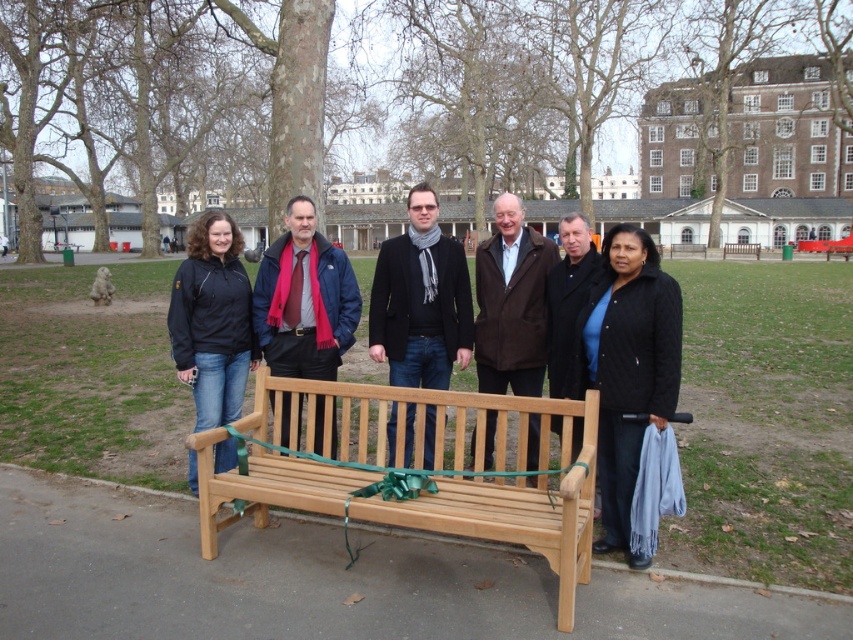
Question: Is natural wood bench at center to the right of black matte jacket at left from the viewer's perspective?

Choices:
 (A) no
 (B) yes

Answer: (B)

Question: Does black quilted jacket at center have a larger size compared to black matte jacket at left?

Choices:
 (A) no
 (B) yes

Answer: (A)

Question: Does brown leather jacket at center have a lesser width compared to wooden bench at center?

Choices:
 (A) yes
 (B) no

Answer: (A)

Question: Which of the following is the closest to the observer?

Choices:
 (A) black quilted jacket at center
 (B) natural wood bench at center
 (C) brown leather jacket at center

Answer: (B)

Question: Considering the real-world distances, which object is closest to the matte blue jacket at center?

Choices:
 (A) black matte jacket at left
 (B) dark gray wool scarf at center
 (C) black quilted jacket at center
 (D) brown leather jacket at center

Answer: (A)

Question: Which object is farther from the camera taking this photo?

Choices:
 (A) black matte jacket at left
 (B) dark gray wool scarf at center
 (C) wooden bench at center
 (D) natural wood bench at center

Answer: (C)